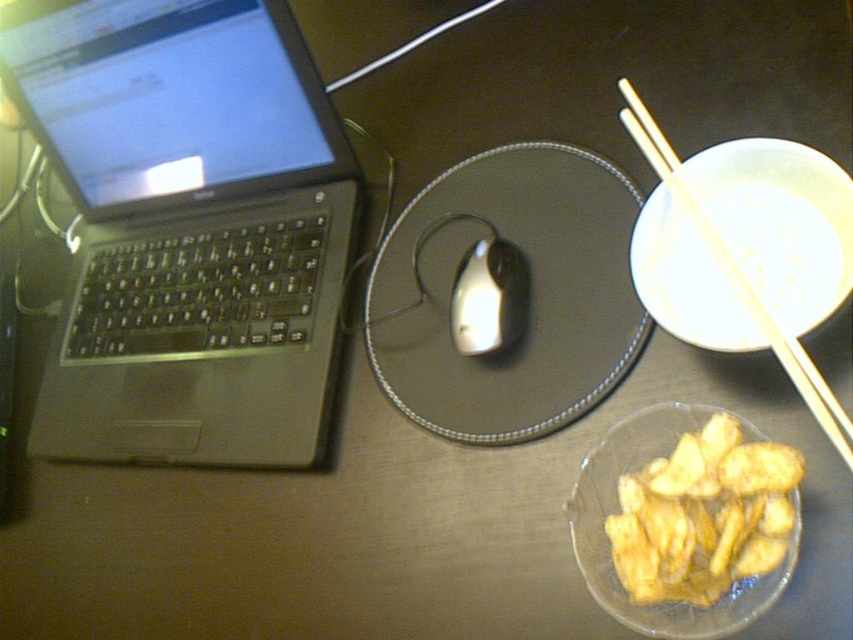
You are a person sitting at the desk and want to reach both the point at [387,300] and the point at [753,552]. Which point should you reach for first to minimize the distance traveled?

You should reach for point [387,300] first because it is closer to you than point [753,552], as it is further away.

You are organizing the desk and want to place a new item between the glossy plastic mouse pad at center and the golden crispy chips at lower right. Is there space available for this?

The glossy plastic mouse pad at center is above golden crispy chips at lower right, so there is vertical space between them where the new item can be placed.